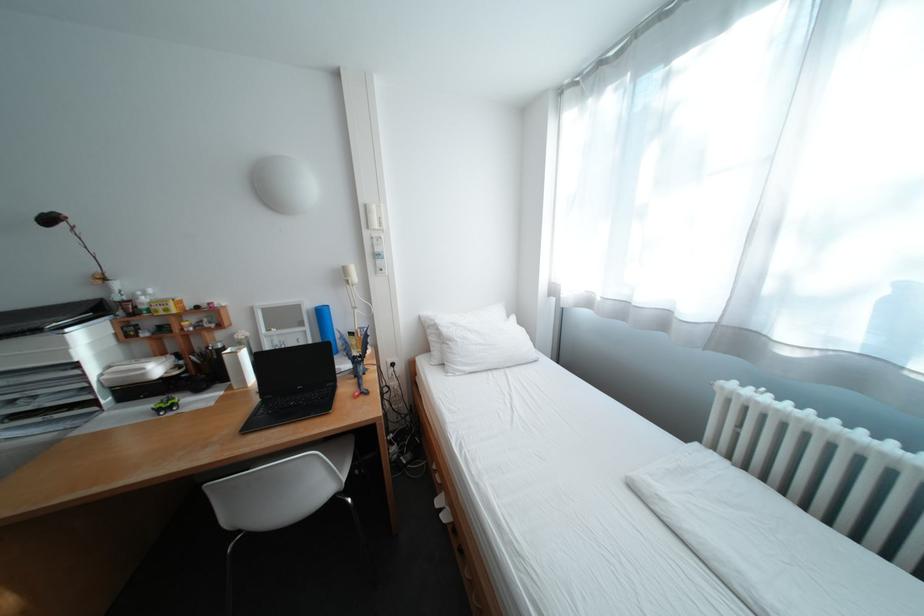
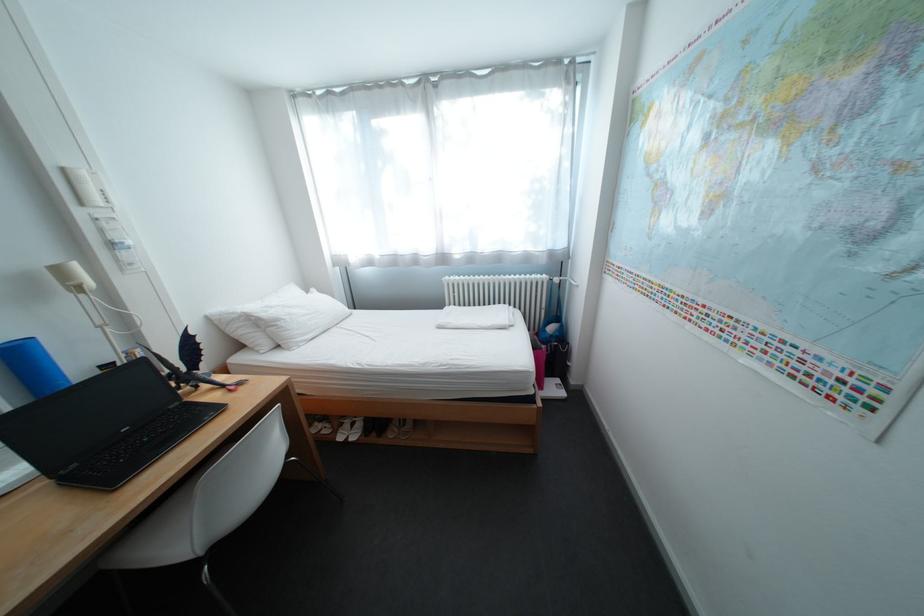
Locate, in the second image, the point that corresponds to the point at 465,342 in the first image.

(292, 322)